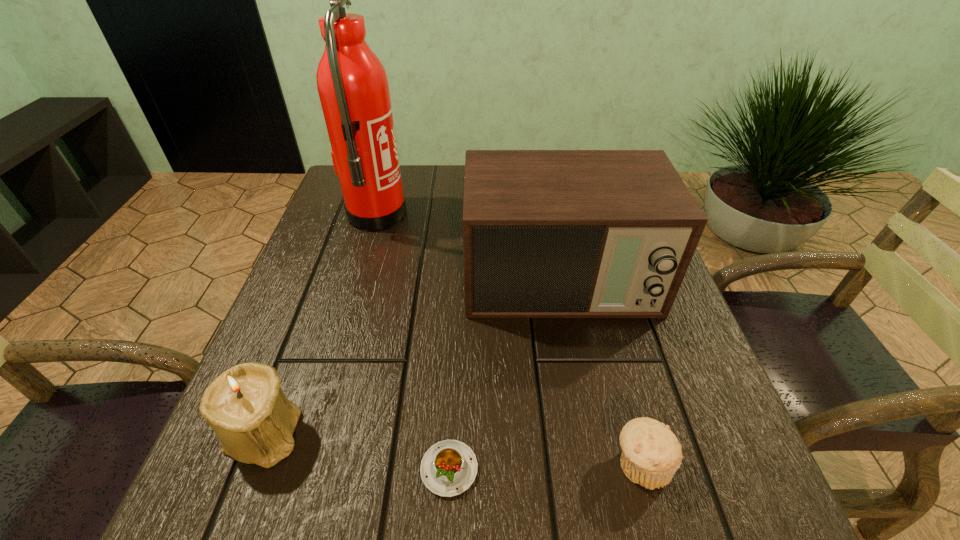
Find the location of `vacant space that is in between the third tallest object and the tallest object`. vacant space that is in between the third tallest object and the tallest object is located at coordinates (x=320, y=324).

Identify the location of unoccupied area between the farthest object and the shortest object. This screenshot has width=960, height=540. (413, 342).

Locate an element on the screen. vacant space that's between the candle_holder and the shortest object is located at coordinates (356, 451).

Where is `free area in between the pudding and the muffin`? free area in between the pudding and the muffin is located at coordinates (545, 466).

The image size is (960, 540). I want to click on the fourth closest object relative to the fourth tallest object, so 353,87.

Identify which object is the fourth closest to the shortest object. Please provide its 2D coordinates. Your answer should be formatted as a tuple, i.e. [(x, y)], where the tuple contains the x and y coordinates of a point satisfying the conditions above.

[(353, 87)]

What are the coordinates of `vacant region that satisfies the following two spatial constraints: 1. on the back side of the shortest object; 2. on the label side of the tallest object` in the screenshot? It's located at (462, 216).

Locate an element on the screen. The width and height of the screenshot is (960, 540). free space that satisfies the following two spatial constraints: 1. on the front-facing side of the second farthest object; 2. on the right side of the muffin is located at coordinates (594, 463).

At what (x,y) coordinates should I click in order to perform the action: click on vacant space that satisfies the following two spatial constraints: 1. on the front side of the shortest object; 2. on the right side of the third tallest object. Please return your answer as a coordinate pair (x, y). The height and width of the screenshot is (540, 960). Looking at the image, I should click on (250, 469).

This screenshot has height=540, width=960. Find the location of `free space that satisfies the following two spatial constraints: 1. on the label side of the pudding; 2. on the left side of the farthest object`. free space that satisfies the following two spatial constraints: 1. on the label side of the pudding; 2. on the left side of the farthest object is located at coordinates (301, 469).